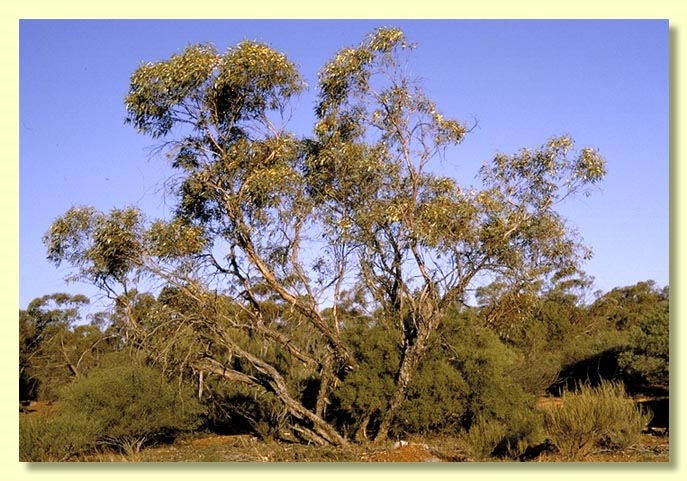
The width and height of the screenshot is (687, 481). Identify the location of pale yellow wall. (682, 281).